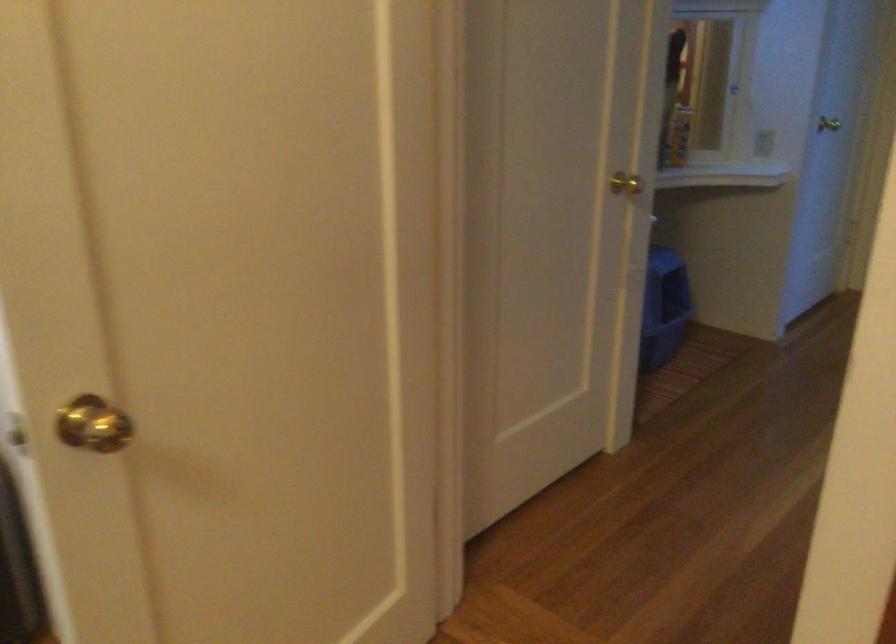
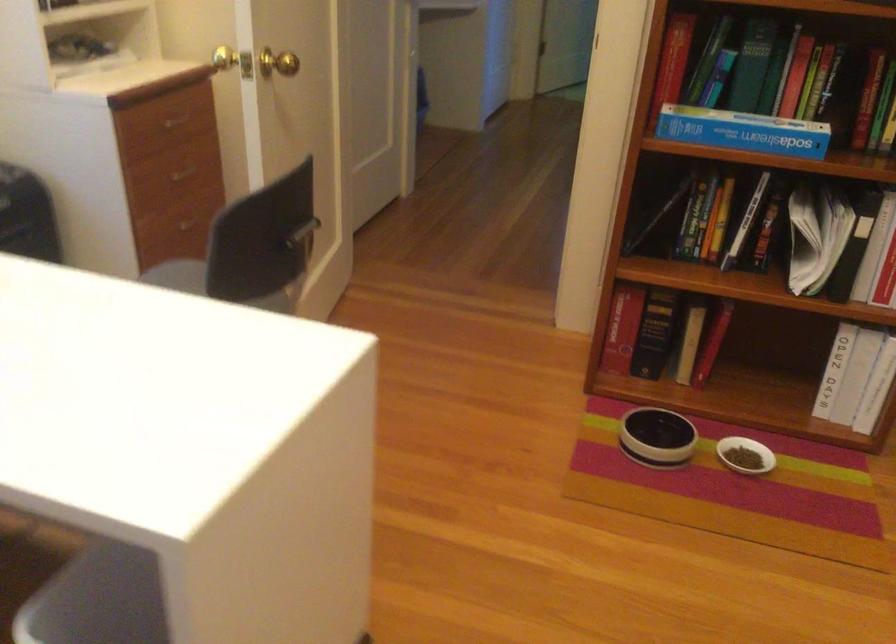
Where in the second image is the point corresponding to (71,406) from the first image?

(233, 61)